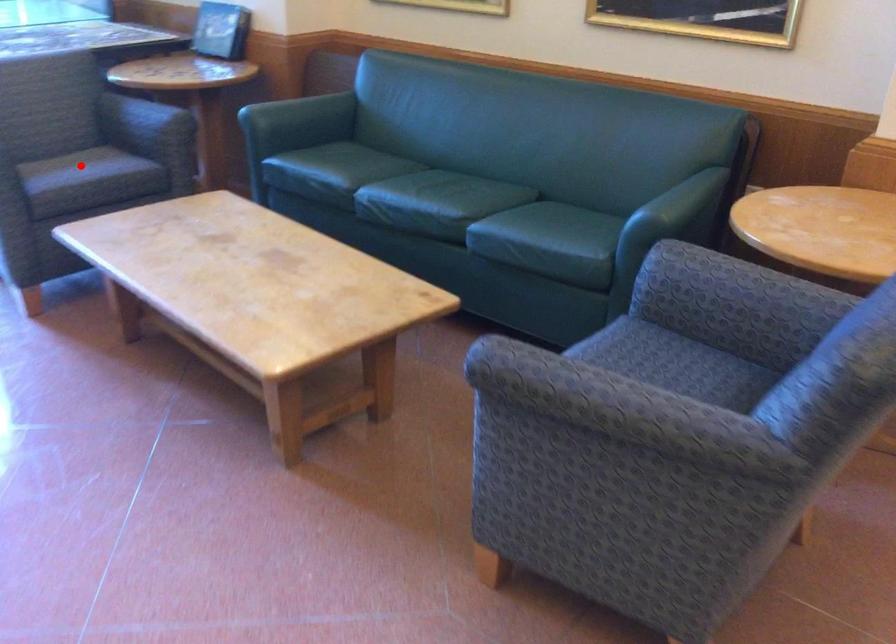
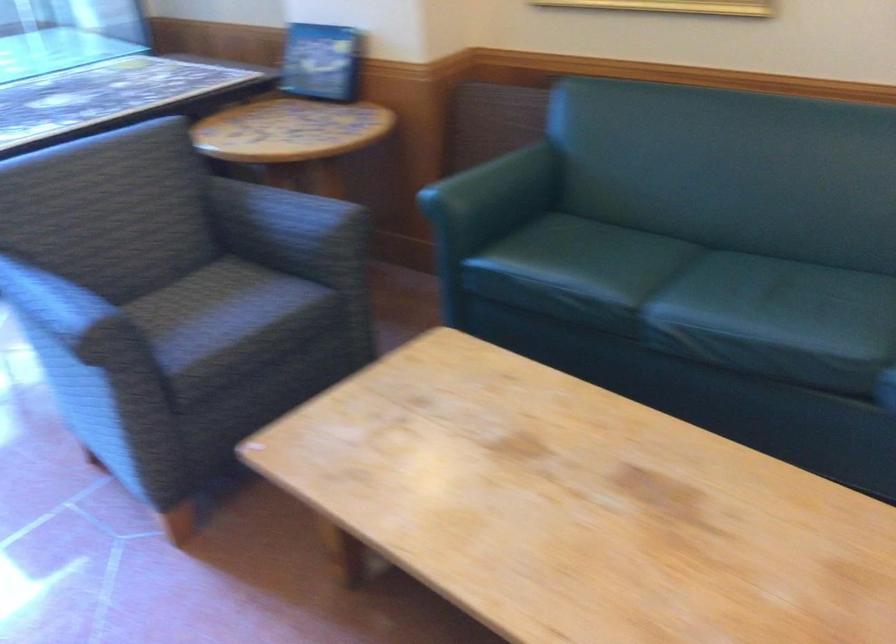
Question: I am providing you with two images of the same scene from different viewpoints. A red point is marked on the first image. Can you still see the location of the red point in image 2?

Choices:
 (A) Yes
 (B) No

Answer: (A)